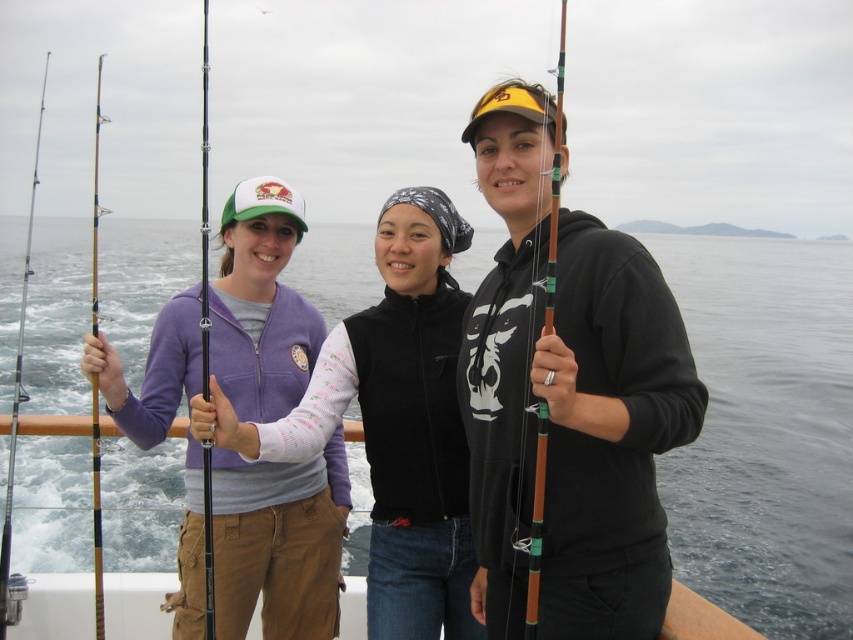
You are planning to store the brown fabric boat at lower center and the black matte fishing pole at left in a storage room. Which object requires more space in the storage room?

The black matte fishing pole at left requires more space in the storage room because it is larger than the brown fabric boat at lower center according to the description.

You are a photographer trying to capture the matte purple fleece at center and the black matte fishing pole at left in a single frame. Since the camera can only focus on objects of similar thickness, will you need to adjust the focus settings for both objects?

The matte purple fleece at center is thinner than the black matte fishing pole at left, so their thickness differs. Therefore, you will need to adjust the focus settings to accommodate both objects.